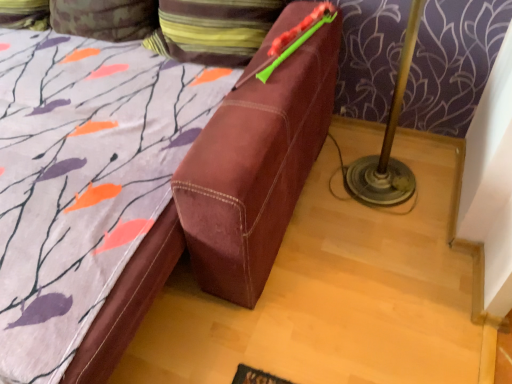
Question: Which direction should I rotate to face velvety brown pillow at upper center, arranged as the 1th pillow when viewed from the right, — up or down?

Choices:
 (A) down
 (B) up

Answer: (B)

Question: From a real-world perspective, does velvety brown pillow at upper center, the 2th pillow from the left, stand above camouflage fabric pillow at upper left, marked as the 2th pillow in a right-to-left arrangement?

Choices:
 (A) yes
 (B) no

Answer: (A)

Question: Is velvety brown pillow at upper center, the 2th pillow from the left, in front of camouflage fabric pillow at upper left, marked as the 2th pillow in a right-to-left arrangement?

Choices:
 (A) yes
 (B) no

Answer: (A)

Question: Does velvety brown pillow at upper center, arranged as the 1th pillow when viewed from the right, lie behind camouflage fabric pillow at upper left, placed as the first pillow when sorted from left to right?

Choices:
 (A) no
 (B) yes

Answer: (A)

Question: From a real-world perspective, is velvety brown pillow at upper center, the 2th pillow from the left, physically below camouflage fabric pillow at upper left, placed as the first pillow when sorted from left to right?

Choices:
 (A) yes
 (B) no

Answer: (B)

Question: From the image's perspective, does velvety brown pillow at upper center, arranged as the 1th pillow when viewed from the right, appear lower than camouflage fabric pillow at upper left, marked as the 2th pillow in a right-to-left arrangement?

Choices:
 (A) no
 (B) yes

Answer: (B)

Question: Is velvety brown pillow at upper center, the 2th pillow from the left, facing towards camouflage fabric pillow at upper left, placed as the first pillow when sorted from left to right?

Choices:
 (A) no
 (B) yes

Answer: (A)

Question: Is camouflage fabric pillow at upper left, marked as the 2th pillow in a right-to-left arrangement, facing away from velvety brown pillow at upper center, arranged as the 1th pillow when viewed from the right?

Choices:
 (A) yes
 (B) no

Answer: (B)

Question: Is camouflage fabric pillow at upper left, placed as the first pillow when sorted from left to right, in front of velvety brown pillow at upper center, arranged as the 1th pillow when viewed from the right?

Choices:
 (A) yes
 (B) no

Answer: (B)

Question: Does camouflage fabric pillow at upper left, placed as the first pillow when sorted from left to right, appear on the right side of velvety brown pillow at upper center, arranged as the 1th pillow when viewed from the right?

Choices:
 (A) yes
 (B) no

Answer: (B)

Question: Could you tell me if camouflage fabric pillow at upper left, placed as the first pillow when sorted from left to right, is turned towards velvety brown pillow at upper center, the 2th pillow from the left?

Choices:
 (A) no
 (B) yes

Answer: (A)

Question: Considering the relative sizes of camouflage fabric pillow at upper left, marked as the 2th pillow in a right-to-left arrangement, and velvety brown pillow at upper center, the 2th pillow from the left, in the image provided, is camouflage fabric pillow at upper left, marked as the 2th pillow in a right-to-left arrangement, wider than velvety brown pillow at upper center, the 2th pillow from the left,?

Choices:
 (A) no
 (B) yes

Answer: (A)

Question: Is camouflage fabric pillow at upper left, marked as the 2th pillow in a right-to-left arrangement, behind velvety brown pillow at upper center, the 2th pillow from the left?

Choices:
 (A) yes
 (B) no

Answer: (A)

Question: Considering the positions of velvety brown pillow at upper center, the 2th pillow from the left, and camouflage fabric pillow at upper left, marked as the 2th pillow in a right-to-left arrangement, in the image, is velvety brown pillow at upper center, the 2th pillow from the left, bigger or smaller than camouflage fabric pillow at upper left, marked as the 2th pillow in a right-to-left arrangement,?

Choices:
 (A) small
 (B) big

Answer: (B)